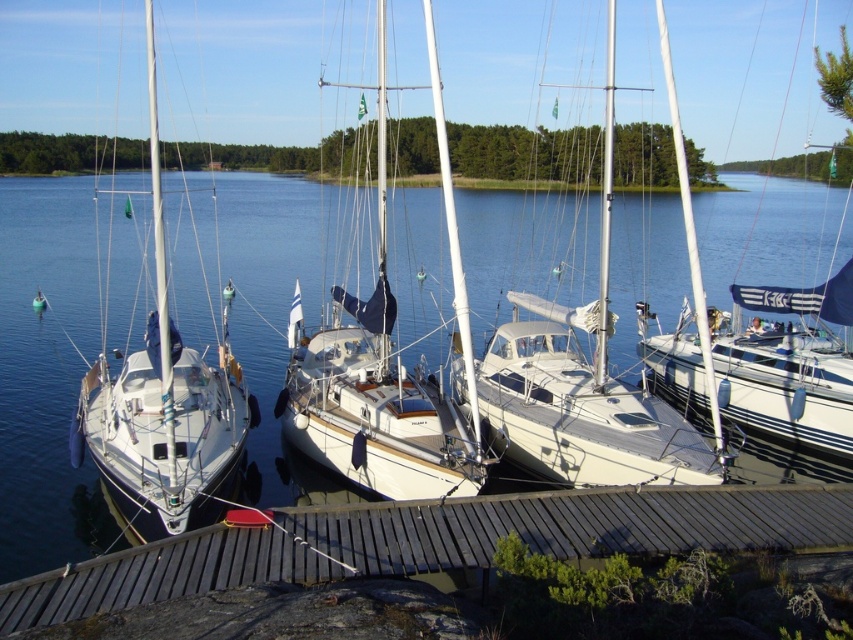
Question: Can you confirm if white matte sailboat at center is wider than white glossy sailboat at center?

Choices:
 (A) yes
 (B) no

Answer: (B)

Question: Which is farther from the white glossy sailboat at center?

Choices:
 (A) white matte sailboat at center
 (B) clear blue water at center
 (C) white glossy sailboat at left

Answer: (B)

Question: Based on their relative distances, which object is nearer to the white matte sailboat at center?

Choices:
 (A) wooden dock at lower center
 (B) white glossy sailboat at center
 (C) white glossy sailboat at left
 (D) clear blue water at center

Answer: (A)

Question: Does white matte sailboat at center come behind white glossy sailboat at center?

Choices:
 (A) yes
 (B) no

Answer: (B)

Question: Does wooden dock at lower center have a greater width compared to white glossy sailboat at center?

Choices:
 (A) yes
 (B) no

Answer: (B)

Question: Based on their relative distances, which object is farther from the white matte sailboat at center?

Choices:
 (A) white glossy sailboat at left
 (B) clear blue water at center
 (C) white glossy sailboat at center

Answer: (B)